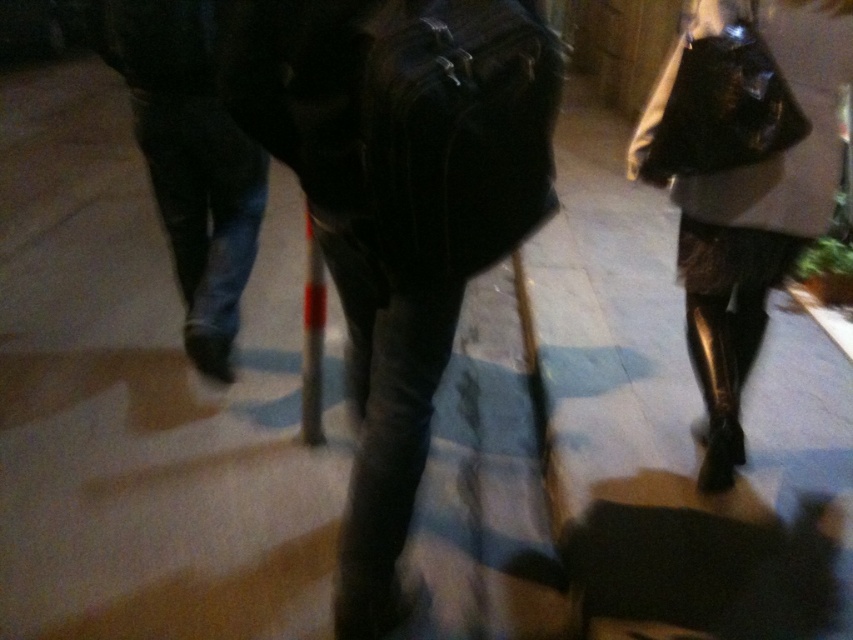
Can you confirm if shiny metallic boots at lower right is bigger than dark denim jeans at left?

Yes.

Image resolution: width=853 pixels, height=640 pixels. Describe the element at coordinates (743, 177) in the screenshot. I see `shiny metallic boots at lower right` at that location.

Locate an element on the screen. Image resolution: width=853 pixels, height=640 pixels. shiny metallic boots at lower right is located at coordinates (743, 177).